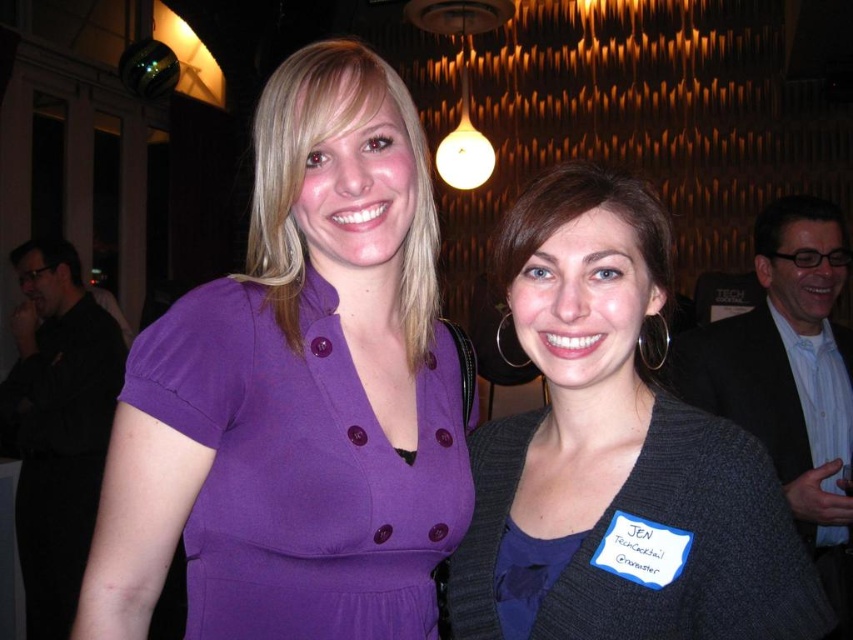
Question: Does matte purple dress at center have a greater width compared to matte glass globe at upper center?

Choices:
 (A) no
 (B) yes

Answer: (A)

Question: Does matte purple dress at center have a lesser width compared to gray textured cardigan at center?

Choices:
 (A) no
 (B) yes

Answer: (A)

Question: Which point is farther to the camera?

Choices:
 (A) matte purple dress at center
 (B) gray textured cardigan at center
 (C) matte glass globe at upper center

Answer: (C)

Question: Which object is positioned closest to the gray textured cardigan at center?

Choices:
 (A) matte glass globe at upper center
 (B) matte purple dress at center

Answer: (B)

Question: Does matte purple dress at center have a lesser width compared to gray textured cardigan at center?

Choices:
 (A) yes
 (B) no

Answer: (B)

Question: Considering the real-world distances, which object is farthest from the gray textured cardigan at center?

Choices:
 (A) matte purple dress at center
 (B) matte glass globe at upper center

Answer: (B)